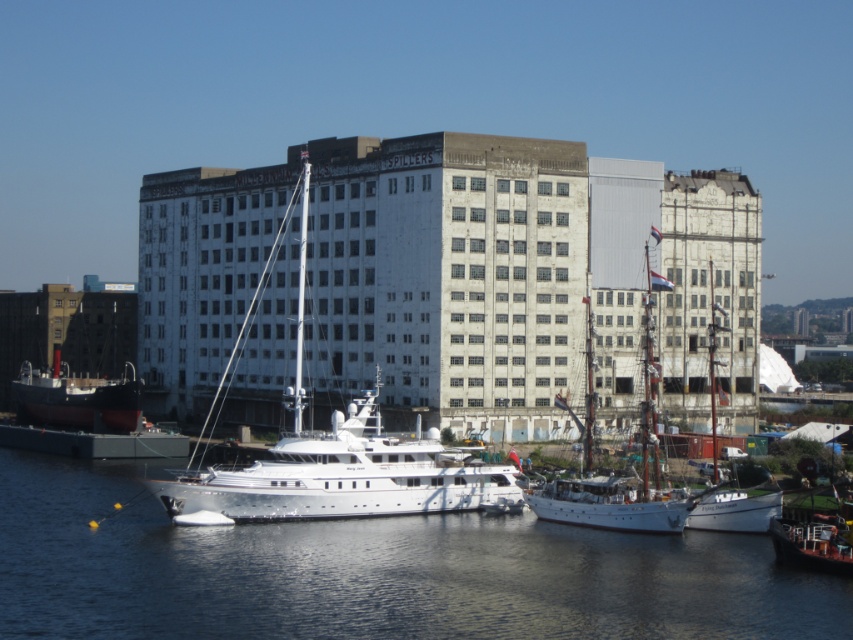
Which of these two, white glossy sailboat at center or wooden sailboat at center, stands shorter?

With less height is wooden sailboat at center.

Which is above, white glossy sailboat at center or wooden sailboat at center?

white glossy sailboat at center is higher up.

Describe the element at coordinates (338, 461) in the screenshot. I see `white glossy sailboat at center` at that location.

This screenshot has height=640, width=853. Find the location of `white glossy sailboat at center`. white glossy sailboat at center is located at coordinates (338, 461).

Which is more to the left, red matte ship at lower left or metallic silver boat at lower right?

red matte ship at lower left

Between red matte ship at lower left and metallic silver boat at lower right, which one is positioned lower?

Positioned lower is metallic silver boat at lower right.

Describe the element at coordinates (76, 397) in the screenshot. The width and height of the screenshot is (853, 640). I see `red matte ship at lower left` at that location.

Locate an element on the screen. The width and height of the screenshot is (853, 640). red matte ship at lower left is located at coordinates (76, 397).

Does point (666, 584) lie behind point (595, 490)?

No, (666, 584) is in front of (595, 490).

Does clear blue water at lower center appear on the right side of wooden sailboat at center?

No, clear blue water at lower center is not to the right of wooden sailboat at center.

Locate an element on the screen. This screenshot has width=853, height=640. clear blue water at lower center is located at coordinates (373, 573).

Where is `clear blue water at lower center`? The height and width of the screenshot is (640, 853). clear blue water at lower center is located at coordinates (373, 573).